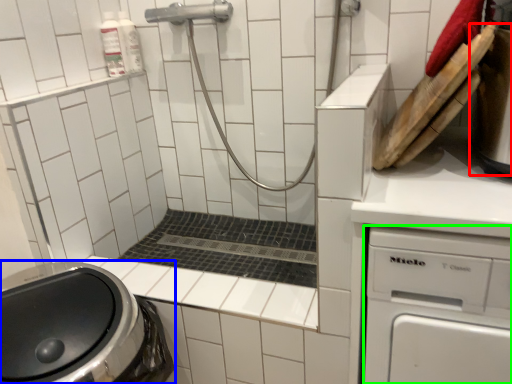
Question: Considering the real-world distances, which object is farthest from appliance (highlighted by a red box)? washing machine (highlighted by a blue box) or dish washer (highlighted by a green box)?

Choices:
 (A) washing machine
 (B) dish washer

Answer: (A)